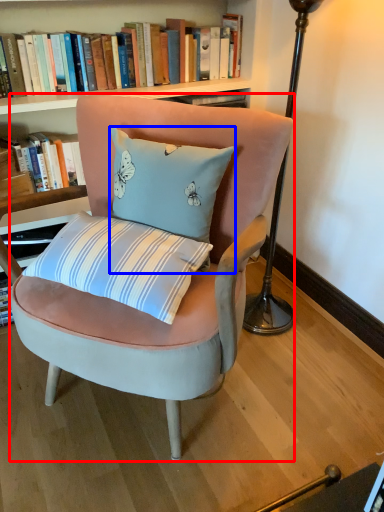
Question: Which object is closer to the camera taking this photo, chair (highlighted by a red box) or pillow (highlighted by a blue box)?

Choices:
 (A) chair
 (B) pillow

Answer: (A)